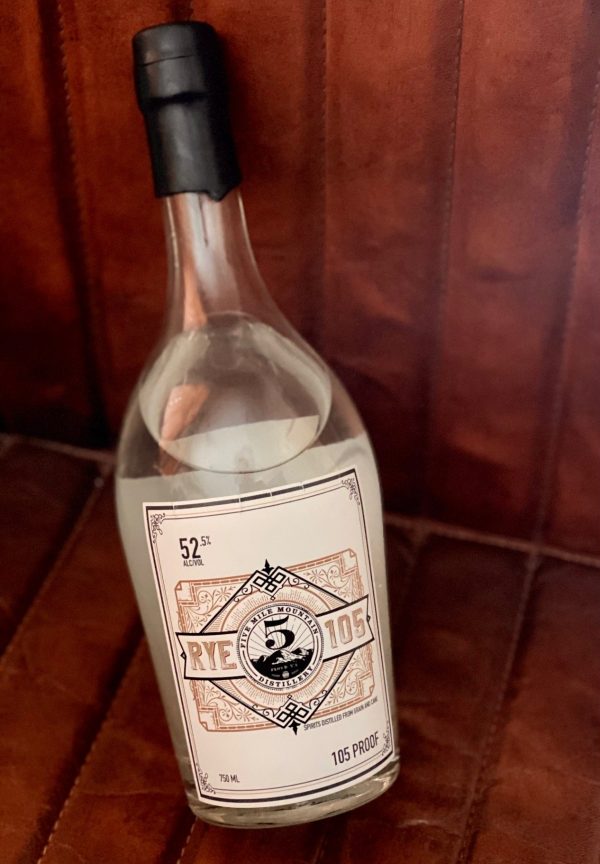
You are a GUI agent. You are given a task and a screenshot of the screen. Output one action in this format:
    pyautogui.click(x=<x>, y=<y>)
    Task: Click on the panel
    The image size is (600, 864).
    Given the screenshot: What is the action you would take?
    pyautogui.click(x=30, y=739)